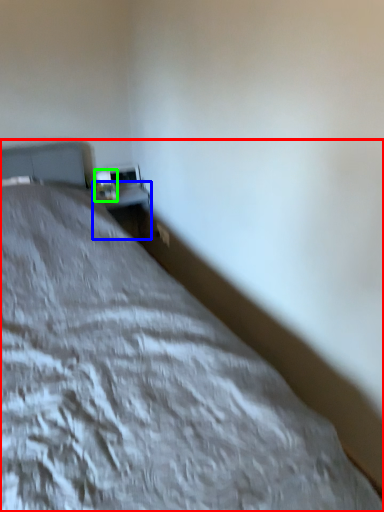
Question: Considering the real-world distances, which object is farthest from bed (highlighted by a red box)? table (highlighted by a blue box) or table lamp (highlighted by a green box)?

Choices:
 (A) table
 (B) table lamp

Answer: (A)